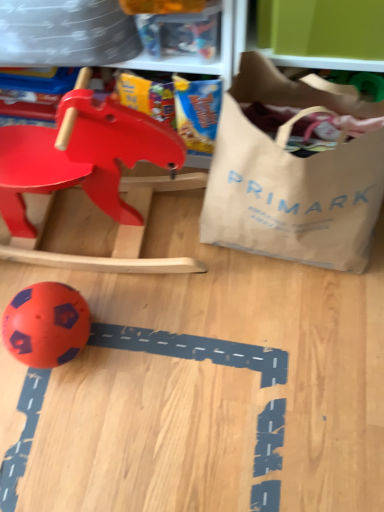
Where is `vacant area that is in front of matte plastic rocking horse at upper left, placed as the second toy when sorted from bottom to top`? Image resolution: width=384 pixels, height=512 pixels. vacant area that is in front of matte plastic rocking horse at upper left, placed as the second toy when sorted from bottom to top is located at coordinates (141, 381).